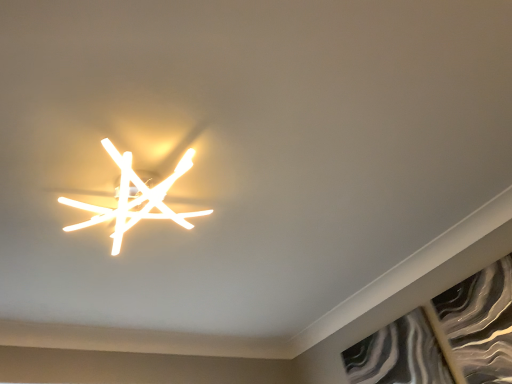
Locate an element on the screen. white matte light fixture at upper center is located at coordinates click(x=135, y=198).

The height and width of the screenshot is (384, 512). What do you see at coordinates (135, 198) in the screenshot? I see `white matte light fixture at upper center` at bounding box center [135, 198].

I want to click on white matte light fixture at upper center, so click(135, 198).